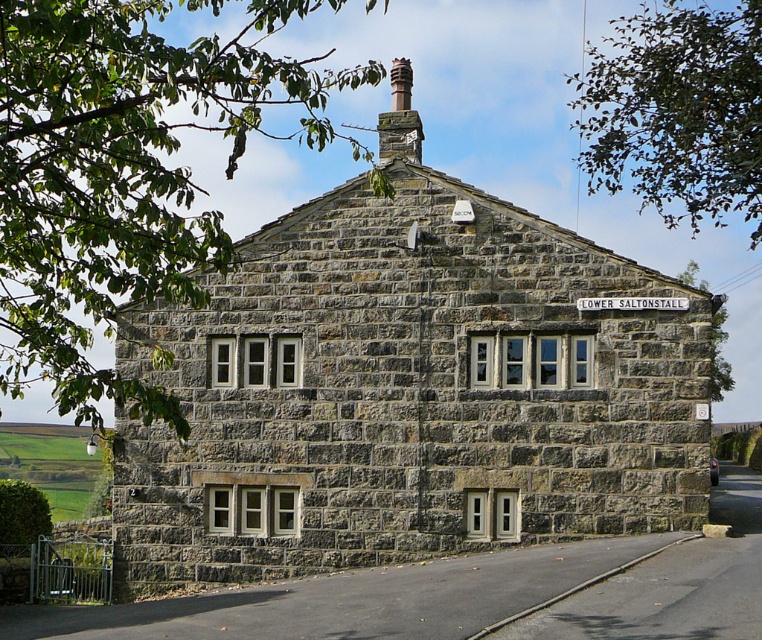
Question: Which of these objects is positioned farthest from the smooth stone chimney at upper center?

Choices:
 (A) stone cottage at center
 (B) white plastic street sign at center

Answer: (B)

Question: Which of the following is the closest to the observer?

Choices:
 (A) smooth stone chimney at upper center
 (B) stone cottage at center
 (C) white plastic street sign at center

Answer: (B)

Question: From the image, what is the correct spatial relationship of stone cottage at center in relation to white plastic street sign at center?

Choices:
 (A) above
 (B) below

Answer: (B)

Question: Does stone cottage at center appear on the left side of smooth stone chimney at upper center?

Choices:
 (A) no
 (B) yes

Answer: (B)

Question: Does stone cottage at center appear on the left side of white plastic street sign at center?

Choices:
 (A) no
 (B) yes

Answer: (B)

Question: Considering the real-world distances, which object is closest to the stone cottage at center?

Choices:
 (A) smooth stone chimney at upper center
 (B) white plastic street sign at center

Answer: (B)